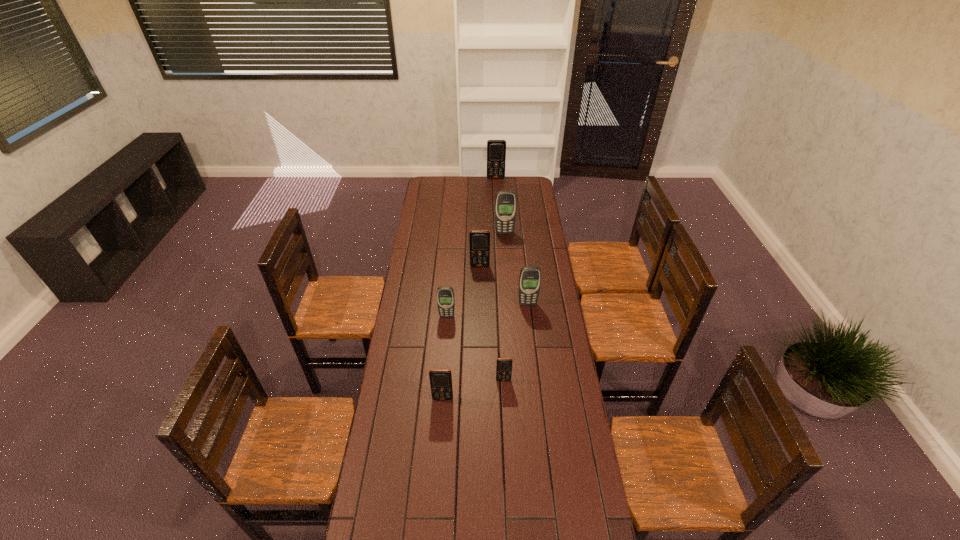
At what (x,y) coordinates should I click in order to perform the action: click on the closest gray cellular telephone to the biggest gray cellular telephone. Please return your answer as a coordinate pair (x, y). This screenshot has width=960, height=540. Looking at the image, I should click on (530, 276).